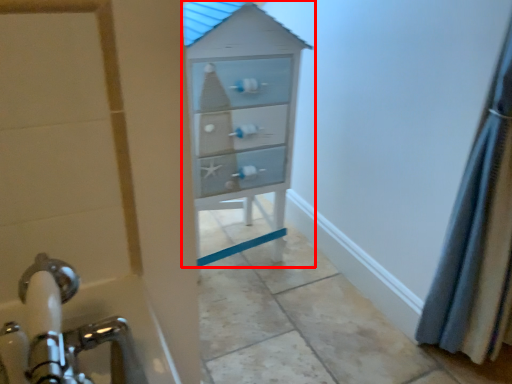
Question: From the image's perspective, what is the correct spatial relationship of chest of drawers (annotated by the red box) in relation to shower curtain?

Choices:
 (A) above
 (B) below

Answer: (A)